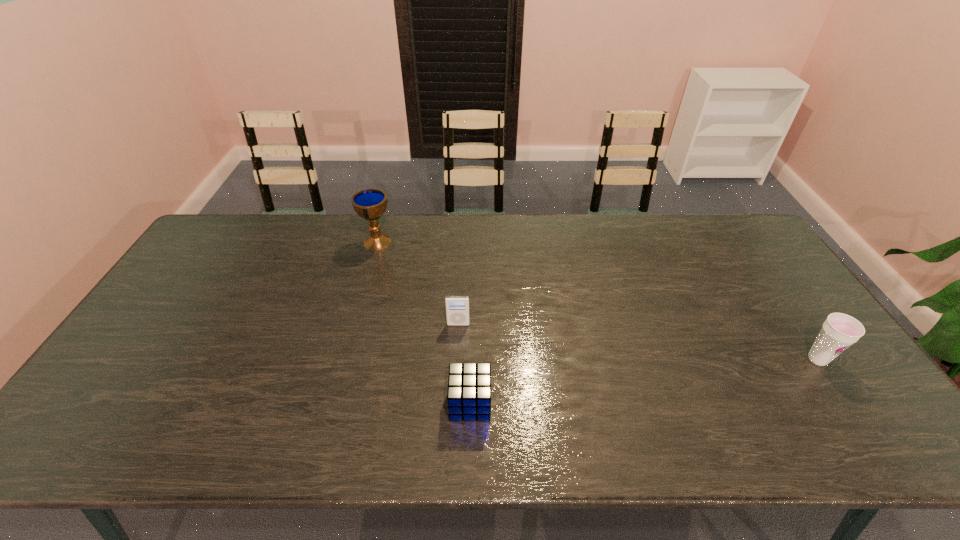
Identify the location of free space that satisfies the following two spatial constraints: 1. on the front-facing side of the cup; 2. on the right side of the iPod. This screenshot has height=540, width=960. (457, 359).

The image size is (960, 540). I want to click on free space that satisfies the following two spatial constraints: 1. on the front side of the rightmost object; 2. on the left side of the leftmost object, so click(346, 359).